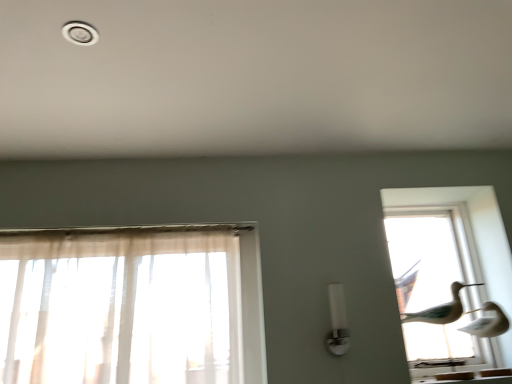
This screenshot has width=512, height=384. What do you see at coordinates (451, 248) in the screenshot? I see `transparent glass birds at right` at bounding box center [451, 248].

This screenshot has height=384, width=512. What do you see at coordinates (80, 33) in the screenshot?
I see `white plastic light fixture at upper left` at bounding box center [80, 33].

The width and height of the screenshot is (512, 384). I want to click on transparent glass birds at right, so click(x=451, y=248).

From the picture: Would you say white plastic light fixture at upper left is part of transparent glass birds at right's contents?

No, white plastic light fixture at upper left is not a part of transparent glass birds at right.

Considering their positions, is transparent glass birds at right located in front of or behind white plastic light fixture at upper left?

transparent glass birds at right is behind white plastic light fixture at upper left.

Between transparent glass birds at right and white plastic light fixture at upper left, which one has more height?

Standing taller between the two is transparent glass birds at right.

From a real-world perspective, is transparent glass birds at right positioned under white plastic light fixture at upper left based on gravity?

Indeed, from a real-world perspective, transparent glass birds at right is positioned beneath white plastic light fixture at upper left.

Can you tell me how much white plastic light fixture at upper left and white glossy light fixture at center differ in facing direction?

white plastic light fixture at upper left and white glossy light fixture at center are facing 90.3 degrees away from each other.

From a real-world perspective, is white plastic light fixture at upper left above or below white glossy light fixture at center?

white plastic light fixture at upper left is situated higher than white glossy light fixture at center in the real world.

Is white plastic light fixture at upper left bigger than white glossy light fixture at center?

No, white plastic light fixture at upper left is not bigger than white glossy light fixture at center.

Is white plastic light fixture at upper left behind white glossy light fixture at center?

No, white plastic light fixture at upper left is in front of white glossy light fixture at center.

Locate an element on the screen. This screenshot has width=512, height=384. dot in front of the white glossy light fixture at center is located at coordinates (80, 33).

Is white plastic light fixture at upper left surrounded by white glossy light fixture at center?

Definitely not — white plastic light fixture at upper left is not inside white glossy light fixture at center.

From a real-world perspective, between white glossy light fixture at center and white plastic light fixture at upper left, who is vertically lower?

In real-world perspective, white glossy light fixture at center is lower.

Which is less distant, (330, 341) or (393, 194)?

Point (330, 341)

In the scene shown: From a real-world perspective, is white glossy light fixture at center below transparent glass birds at right?

Yes, from a real-world perspective, white glossy light fixture at center is under transparent glass birds at right.

Is white glossy light fixture at center placed right next to transparent glass birds at right?

There is a gap between white glossy light fixture at center and transparent glass birds at right.

Considering the relative sizes of white plastic light fixture at upper left and transparent glass birds at right in the image provided, is white plastic light fixture at upper left wider than transparent glass birds at right?

Yes, white plastic light fixture at upper left is wider than transparent glass birds at right.

From the image's perspective, which one is positioned higher, white plastic light fixture at upper left or transparent glass birds at right?

white plastic light fixture at upper left.

How many degrees apart are the facing directions of white plastic light fixture at upper left and transparent glass birds at right?

91.6 degrees.

Is white plastic light fixture at upper left bigger than transparent glass birds at right?

Incorrect, white plastic light fixture at upper left is not larger than transparent glass birds at right.

Is transparent glass birds at right next to white glossy light fixture at center?

No, transparent glass birds at right is not beside white glossy light fixture at center.

From the image's perspective, between transparent glass birds at right and white glossy light fixture at center, which one is located above?

transparent glass birds at right appears higher in the image.

Considering the sizes of transparent glass birds at right and white glossy light fixture at center in the image, is transparent glass birds at right wider or thinner than white glossy light fixture at center?

Clearly, transparent glass birds at right has more width compared to white glossy light fixture at center.

You are a GUI agent. You are given a task and a screenshot of the screen. Output one action in this format:
    pyautogui.click(x=<x>, y=<y>)
    Task: Click on the window behind the white plastic light fixture at upper left
    The image size is (512, 384).
    Given the screenshot: What is the action you would take?
    pyautogui.click(x=451, y=248)

I want to click on dot in front of the white glossy light fixture at center, so click(x=80, y=33).

Looking at this image, when comparing their distances from white glossy light fixture at center, does transparent glass birds at right or white plastic light fixture at upper left seem closer?

Based on the image, transparent glass birds at right appears to be nearer to white glossy light fixture at center.

In the scene shown: Which object lies nearer to the anchor point white plastic light fixture at upper left, white glossy light fixture at center or transparent glass birds at right?

white glossy light fixture at center.

Which object lies nearer to the anchor point white glossy light fixture at center, white plastic light fixture at upper left or transparent glass birds at right?

transparent glass birds at right is positioned closer to the anchor white glossy light fixture at center.

From the image, which object appears to be farther from white plastic light fixture at upper left, transparent glass birds at right or white glossy light fixture at center?

Based on the image, transparent glass birds at right appears to be further to white plastic light fixture at upper left.

Based on their spatial positions, is white glossy light fixture at center or white plastic light fixture at upper left closer to transparent glass birds at right?

white glossy light fixture at center.

Considering their positions, is white plastic light fixture at upper left positioned closer to transparent glass birds at right than white glossy light fixture at center?

Based on the image, white glossy light fixture at center appears to be nearer to transparent glass birds at right.

This screenshot has height=384, width=512. Identify the location of light fixture between white plastic light fixture at upper left and transparent glass birds at right. (337, 321).